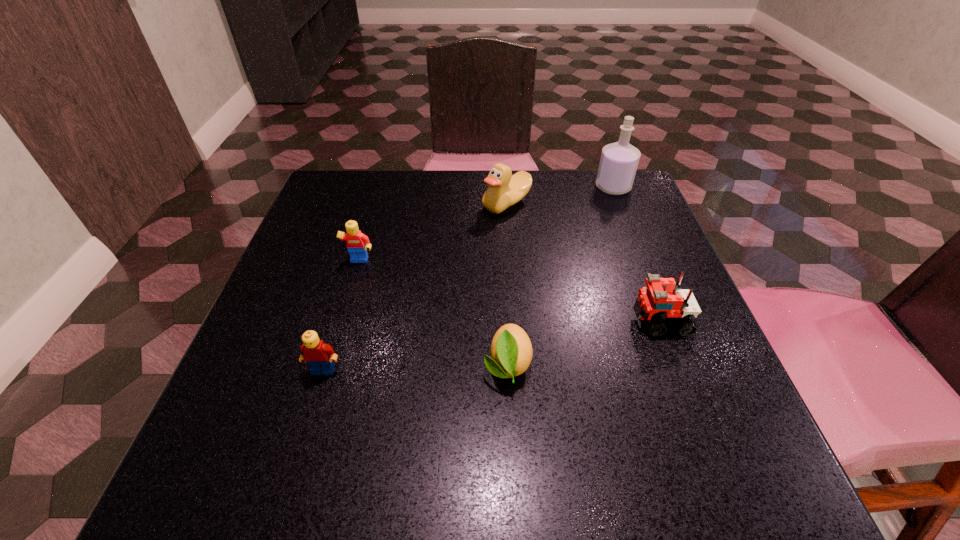
At what (x,y) coordinates should I click in order to perform the action: click on free spot that satisfies the following two spatial constraints: 1. on the front-facing side of the fourth farthest object; 2. on the front-facing side of the nearest Lego. Please return your answer as a coordinate pair (x, y). Looking at the image, I should click on (680, 370).

Where is `free point that satisfies the following two spatial constraints: 1. at the beak of the duck; 2. on the front-facing side of the nearest Lego`? This screenshot has height=540, width=960. free point that satisfies the following two spatial constraints: 1. at the beak of the duck; 2. on the front-facing side of the nearest Lego is located at coordinates (519, 370).

The width and height of the screenshot is (960, 540). What are the coordinates of `vacant area in the image that satisfies the following two spatial constraints: 1. at the beak of the duck; 2. on the face of the farthest Lego` in the screenshot? It's located at click(x=511, y=262).

Where is `vacant area that satisfies the following two spatial constraints: 1. at the beak of the duck; 2. on the face of the third farthest object`? The height and width of the screenshot is (540, 960). vacant area that satisfies the following two spatial constraints: 1. at the beak of the duck; 2. on the face of the third farthest object is located at coordinates (511, 262).

At what (x,y) coordinates should I click in order to perform the action: click on free location that satisfies the following two spatial constraints: 1. at the beak of the duck; 2. with leaves positioned above the shortest object. Please return your answer as a coordinate pair (x, y). The width and height of the screenshot is (960, 540). Looking at the image, I should click on (518, 364).